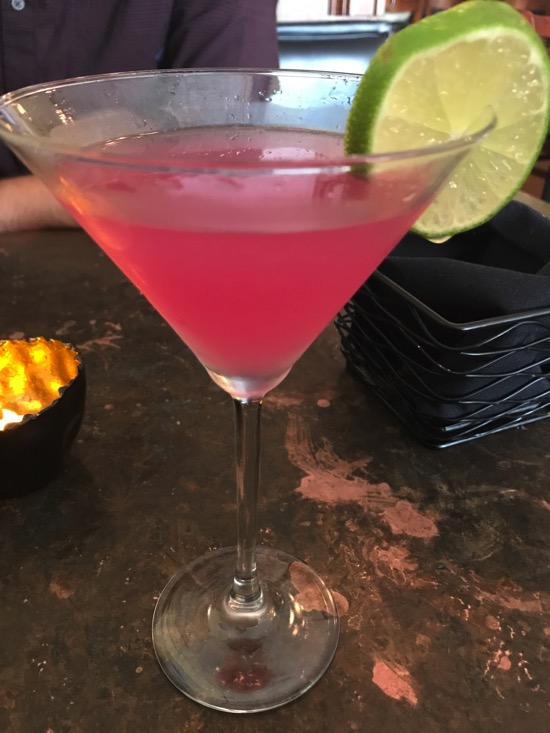
Image resolution: width=550 pixels, height=733 pixels. I want to click on tabletop, so click(x=126, y=339), click(x=126, y=463), click(x=412, y=578), click(x=324, y=352), click(x=539, y=202).